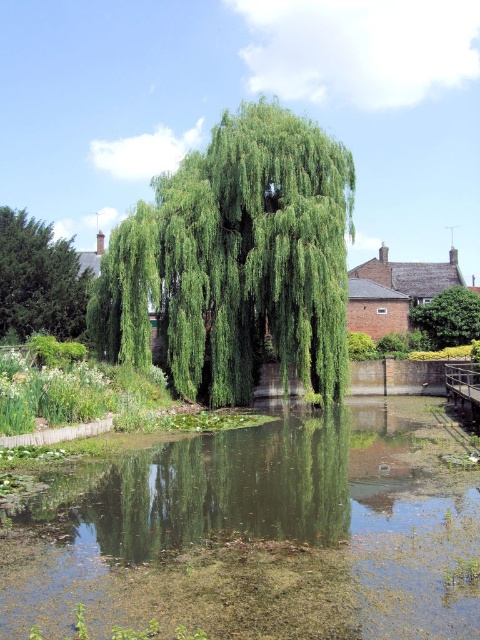
Can you confirm if green leafy willow at center is positioned to the right of green leafy tree at center?

In fact, green leafy willow at center is to the left of green leafy tree at center.

Does green leafy willow at center appear over green leafy tree at center?

Indeed, green leafy willow at center is positioned over green leafy tree at center.

Is point (324, 372) in front of point (462, 332)?

Yes, it is in front of point (462, 332).

Where is `green leafy willow at center`? Image resolution: width=480 pixels, height=640 pixels. green leafy willow at center is located at coordinates (237, 260).

Does green leafy vegetation at center have a smaller size compared to green leafy tree at center?

Actually, green leafy vegetation at center might be larger than green leafy tree at center.

Identify the location of green leafy vegetation at center. The height and width of the screenshot is (640, 480). (260, 532).

The height and width of the screenshot is (640, 480). In order to click on green leafy vegetation at center in this screenshot , I will do `click(260, 532)`.

Locate an element on the screen. green leafy vegetation at center is located at coordinates (260, 532).

Can you confirm if green leafy tree at left is positioned to the right of green leafy tree at center?

In fact, green leafy tree at left is to the left of green leafy tree at center.

Between green leafy tree at left and green leafy tree at center, which one is positioned lower?

green leafy tree at center

Does point (11, 314) come farther from viewer compared to point (479, 300)?

No.

Locate an element on the screen. green leafy tree at left is located at coordinates (38, 280).